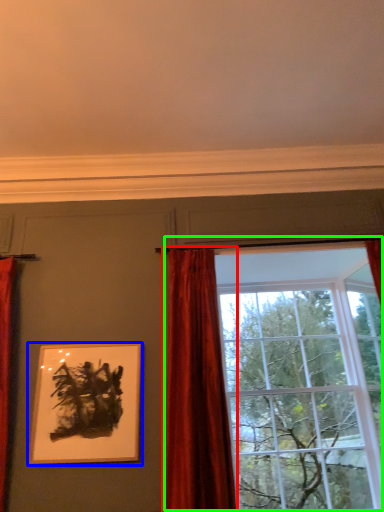
Question: Considering the real-world distances, which object is closest to curtain (highlighted by a red box)? picture frame (highlighted by a blue box) or window (highlighted by a green box).

Choices:
 (A) picture frame
 (B) window

Answer: (B)